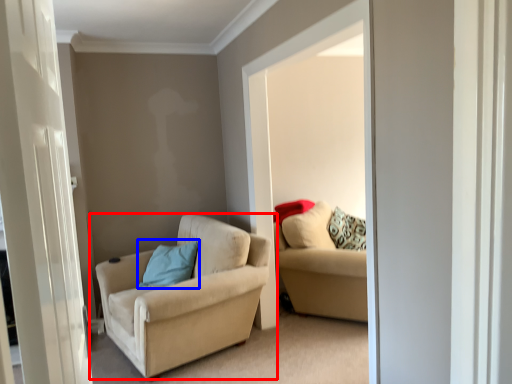
Question: Which of the following is the closest to the observer, chair (highlighted by a red box) or pillow (highlighted by a blue box)?

Choices:
 (A) chair
 (B) pillow

Answer: (A)